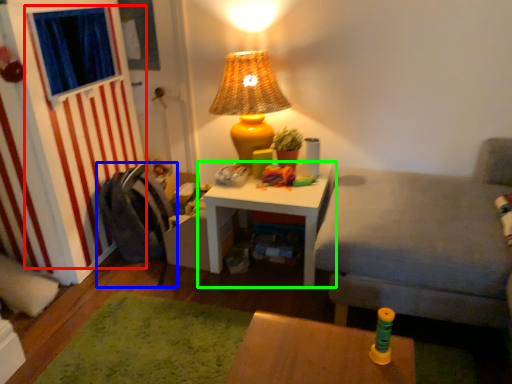
Question: Which object is the farthest from curtain (highlighted by a red box)? Choose among these: swivel chair (highlighted by a blue box) or table (highlighted by a green box).

Choices:
 (A) swivel chair
 (B) table

Answer: (B)